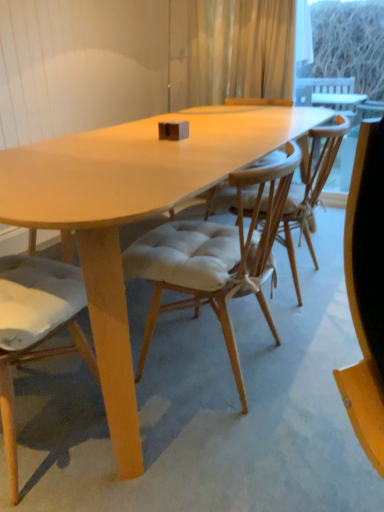
Question: Relative to light beige fabric chair at center, which is the second chair in left-to-right order, is translucent fabric curtain at upper center in front or behind?

Choices:
 (A) behind
 (B) front

Answer: (A)

Question: From a real-world perspective, is translucent fabric curtain at upper center positioned above or below light beige fabric chair at center, which is the second chair in left-to-right order?

Choices:
 (A) below
 (B) above

Answer: (B)

Question: Considering the real-world distances, which object is closest to the light beige fabric chair at center, which is the second chair in left-to-right order?

Choices:
 (A) transparent glass window screen at upper right
 (B) light brown wood chair at center, the 1th chair viewed from the left
 (C) translucent fabric curtain at upper center

Answer: (B)

Question: Considering the real-world distances, which object is farthest from the light brown wood chair at center, the 1th chair viewed from the left?

Choices:
 (A) transparent glass window screen at upper right
 (B) translucent fabric curtain at upper center
 (C) light beige fabric chair at center, the 1th chair when ordered from right to left

Answer: (A)